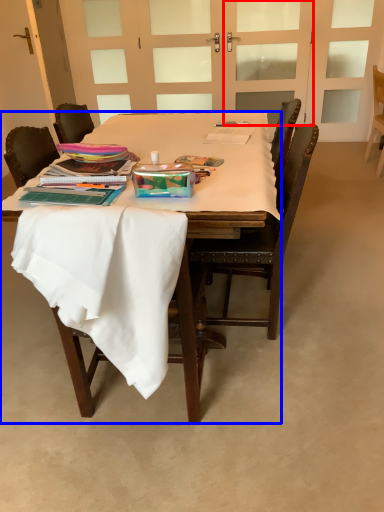
Question: Which object is closer to the camera taking this photo, screen door (highlighted by a red box) or desk (highlighted by a blue box)?

Choices:
 (A) screen door
 (B) desk

Answer: (B)